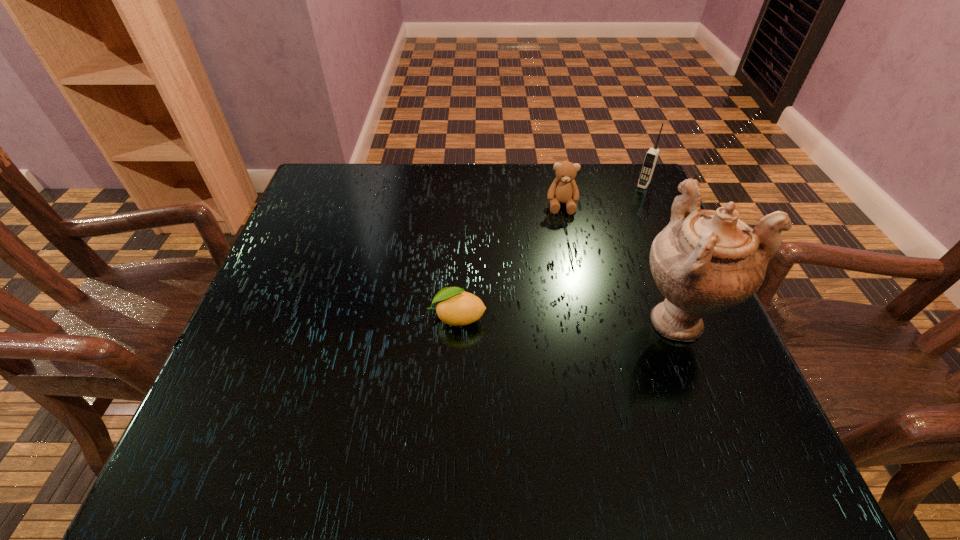
Identify the location of the shortest object. This screenshot has width=960, height=540. (455, 307).

Locate an element on the screen. The height and width of the screenshot is (540, 960). the leftmost object is located at coordinates (455, 307).

Where is `the tallest object`? Image resolution: width=960 pixels, height=540 pixels. the tallest object is located at coordinates (704, 261).

Where is `the third shortest object`? This screenshot has height=540, width=960. the third shortest object is located at coordinates (651, 157).

Find the location of `cellular telephone`. cellular telephone is located at coordinates coord(651,157).

Locate an element on the screen. the third tallest object is located at coordinates (563, 190).

Locate an element on the screen. The width and height of the screenshot is (960, 540). teddy bear is located at coordinates (563, 190).

At what (x,y) coordinates should I click in order to perform the action: click on vacant space located with leaves positioned above the lemon. Please return your answer as a coordinate pair (x, y). The image size is (960, 540). Looking at the image, I should click on (351, 318).

Identify the location of free region located with leaves positioned above the lemon. The width and height of the screenshot is (960, 540). (382, 318).

Find the location of a particular element. vacant space located with leaves positioned above the lemon is located at coordinates [x=290, y=318].